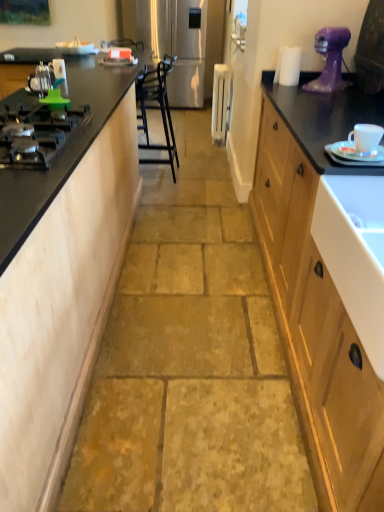
Question: From the image's perspective, is purple plastic mixer at upper right below black matte gas stove at left?

Choices:
 (A) no
 (B) yes

Answer: (A)

Question: Considering the relative positions of purple plastic mixer at upper right and black matte gas stove at left in the image provided, is purple plastic mixer at upper right in front of black matte gas stove at left?

Choices:
 (A) yes
 (B) no

Answer: (B)

Question: Is purple plastic mixer at upper right positioned beyond the bounds of black matte gas stove at left?

Choices:
 (A) yes
 (B) no

Answer: (A)

Question: Is purple plastic mixer at upper right facing towards black matte gas stove at left?

Choices:
 (A) yes
 (B) no

Answer: (A)

Question: Considering the relative sizes of purple plastic mixer at upper right and black matte gas stove at left in the image provided, is purple plastic mixer at upper right smaller than black matte gas stove at left?

Choices:
 (A) no
 (B) yes

Answer: (B)

Question: Is white plastic radiator at center, positioned as the second appliance in right-to-left order, wider or thinner than black metal chair at center?

Choices:
 (A) thin
 (B) wide

Answer: (A)

Question: Based on their sizes in the image, would you say white plastic radiator at center, which is counted as the 3th appliance, starting from the left, is bigger or smaller than black metal chair at center?

Choices:
 (A) big
 (B) small

Answer: (B)

Question: Does point (213, 69) appear closer or farther from the camera than point (137, 98)?

Choices:
 (A) closer
 (B) farther

Answer: (B)

Question: From a real-world perspective, is white plastic radiator at center, which appears as the 3th appliance when viewed from the front, physically located above or below black metal chair at center?

Choices:
 (A) above
 (B) below

Answer: (B)

Question: Is metallic silver kettle at left, positioned as the second appliance in front-to-back order, wider or thinner than black metal chair at center?

Choices:
 (A) thin
 (B) wide

Answer: (A)

Question: Considering the positions of metallic silver kettle at left, which is counted as the 3th appliance, starting from the top, and black metal chair at center in the image, is metallic silver kettle at left, which is counted as the 3th appliance, starting from the top, bigger or smaller than black metal chair at center?

Choices:
 (A) small
 (B) big

Answer: (A)

Question: Is metallic silver kettle at left, which ranks as the fourth appliance in right-to-left order, inside or outside of black metal chair at center?

Choices:
 (A) inside
 (B) outside

Answer: (B)

Question: From the image's perspective, relative to black metal chair at center, is metallic silver kettle at left, which is counted as the 3th appliance, starting from the top, above or below?

Choices:
 (A) below
 (B) above

Answer: (A)

Question: In terms of width, does matte wood cabinet at left look wider or thinner when compared to metallic silver kettle at left, marked as the 1th appliance in a left-to-right arrangement?

Choices:
 (A) thin
 (B) wide

Answer: (B)

Question: Would you say matte wood cabinet at left is inside or outside metallic silver kettle at left, which is counted as the second appliance, starting from the bottom?

Choices:
 (A) inside
 (B) outside

Answer: (B)